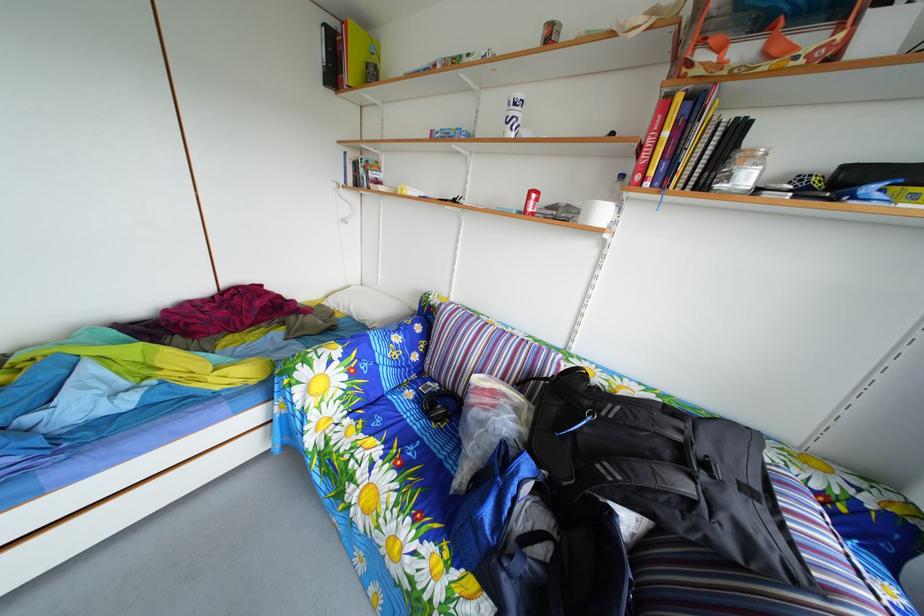
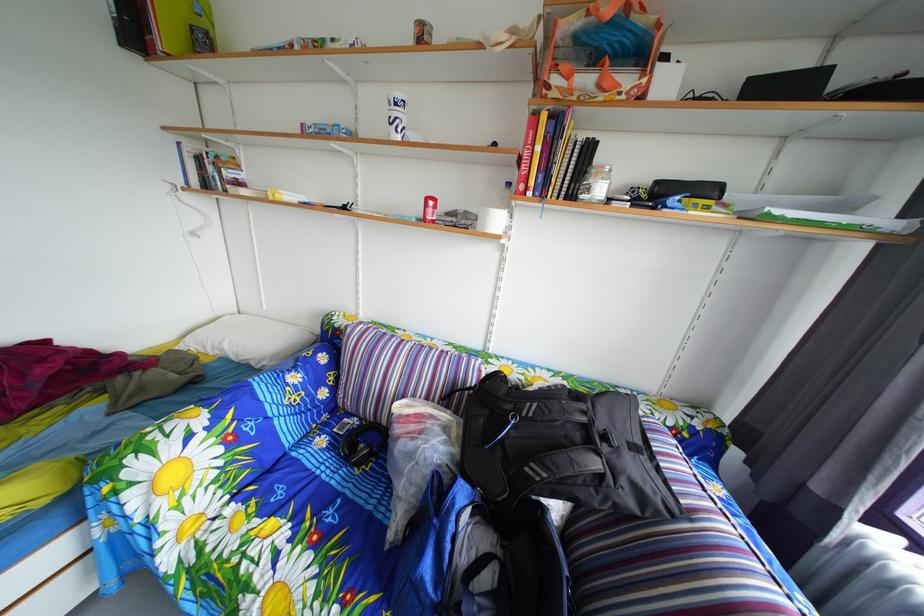
Locate, in the second image, the point that corresponds to pixel 523 116 in the first image.

(404, 116)